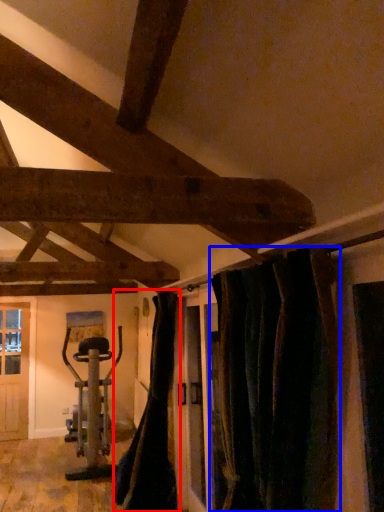
Question: Among these objects, which one is nearest to the camera, curtain (highlighted by a red box) or curtain (highlighted by a blue box)?

Choices:
 (A) curtain
 (B) curtain

Answer: (B)